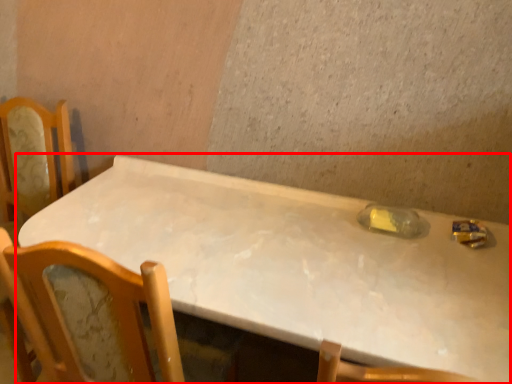
Question: In this image, where is table (annotated by the red box) located relative to bottle?

Choices:
 (A) right
 (B) left

Answer: (B)